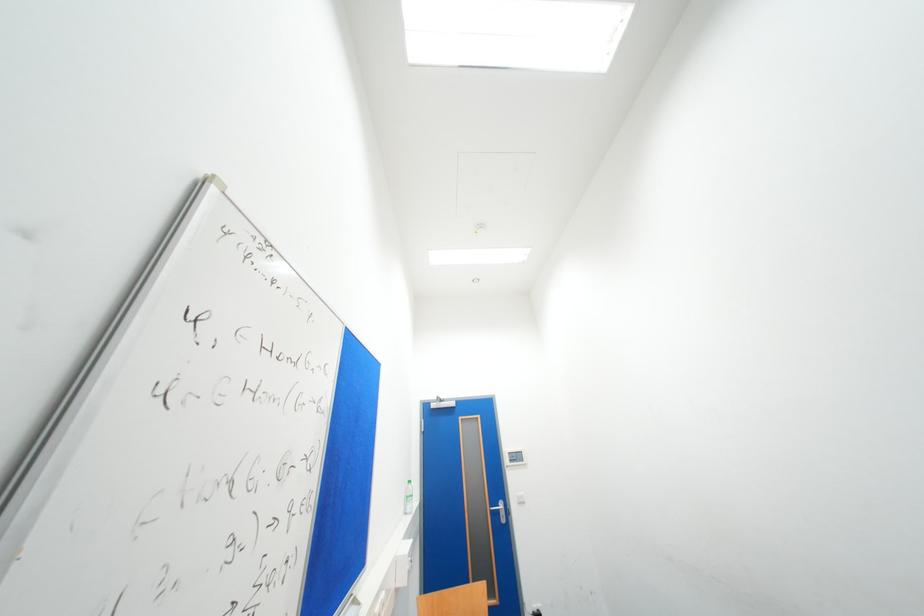
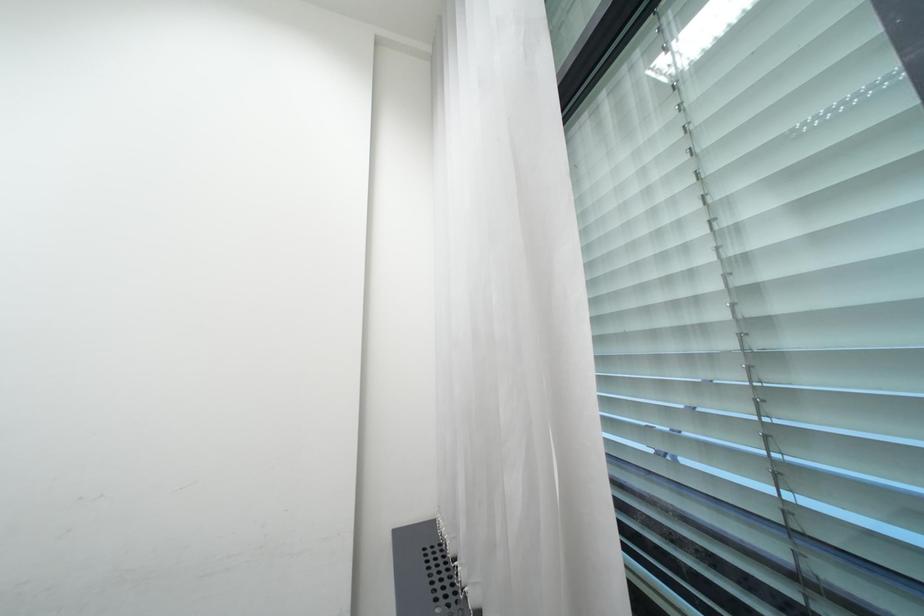
First-person continuous shooting, in which direction is the camera rotating?

The camera's rotation is toward right-up.